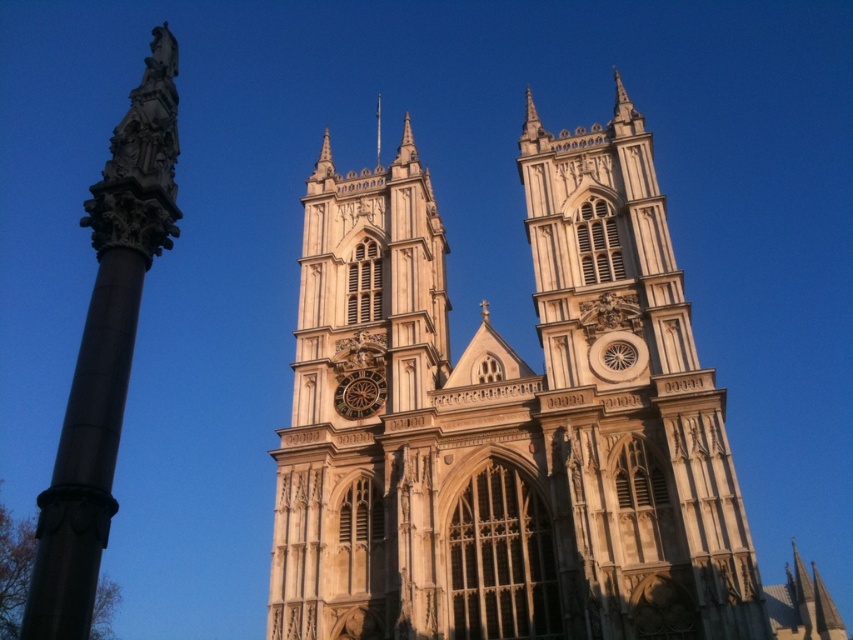
Does point (450, 467) lie behind point (376, 164)?

No, (450, 467) is closer to viewer.

You are a GUI agent. You are given a task and a screenshot of the screen. Output one action in this format:
    pyautogui.click(x=<x>, y=<y>)
    Task: Click on the beige stone church at center
    The width and height of the screenshot is (853, 640).
    Given the screenshot: What is the action you would take?
    pyautogui.click(x=514, y=424)

In the scene shown: Can you confirm if beige stone church at center is positioned to the left of polished stone column at left?

No, beige stone church at center is not to the left of polished stone column at left.

Identify the location of beige stone church at center. Image resolution: width=853 pixels, height=640 pixels. (514, 424).

How far apart are polished stone column at left and white stone spire at upper center?

309.85 feet

Looking at this image, is polished stone column at left taller than white stone spire at upper center?

Yes.

Locate an element on the screen. polished stone column at left is located at coordinates (x=105, y=349).